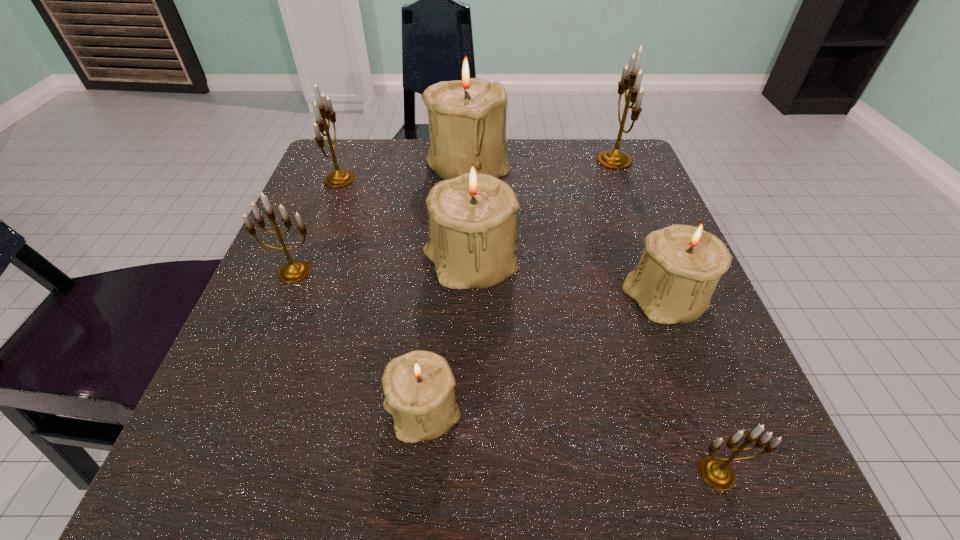
This screenshot has width=960, height=540. In order to click on object that is positioned at the near right corner in this screenshot , I will do `click(716, 472)`.

What are the coordinates of `free space at the far edge of the desktop` in the screenshot? It's located at (391, 195).

This screenshot has width=960, height=540. What are the coordinates of `free space at the near edge of the desktop` in the screenshot? It's located at 501,435.

You are a GUI agent. You are given a task and a screenshot of the screen. Output one action in this format:
    pyautogui.click(x=<x>, y=<y>)
    Task: Click on the vacant space at the left edge of the desktop
    This screenshot has height=540, width=960.
    Given the screenshot: What is the action you would take?
    pyautogui.click(x=376, y=213)

In the image, there is a desktop. Where is `vacant region at the right edge`? The width and height of the screenshot is (960, 540). vacant region at the right edge is located at coordinates (625, 279).

Locate an element on the screen. The width and height of the screenshot is (960, 540). vacant region at the far left corner is located at coordinates (368, 171).

In the image, there is a desktop. At what (x,y) coordinates should I click in order to perform the action: click on free region at the near left corner. Please return your answer as a coordinate pair (x, y). The image size is (960, 540). Looking at the image, I should click on (214, 471).

Identify the location of free space at the far right corner of the desktop. (611, 179).

Locate an element on the screen. This screenshot has height=540, width=960. empty location between the second smallest gold candelabrum and the seventh farthest object is located at coordinates (358, 342).

What are the coordinates of `unoccupied position between the third smallest beige candle_holder and the third biggest beige candle_holder` in the screenshot? It's located at (568, 282).